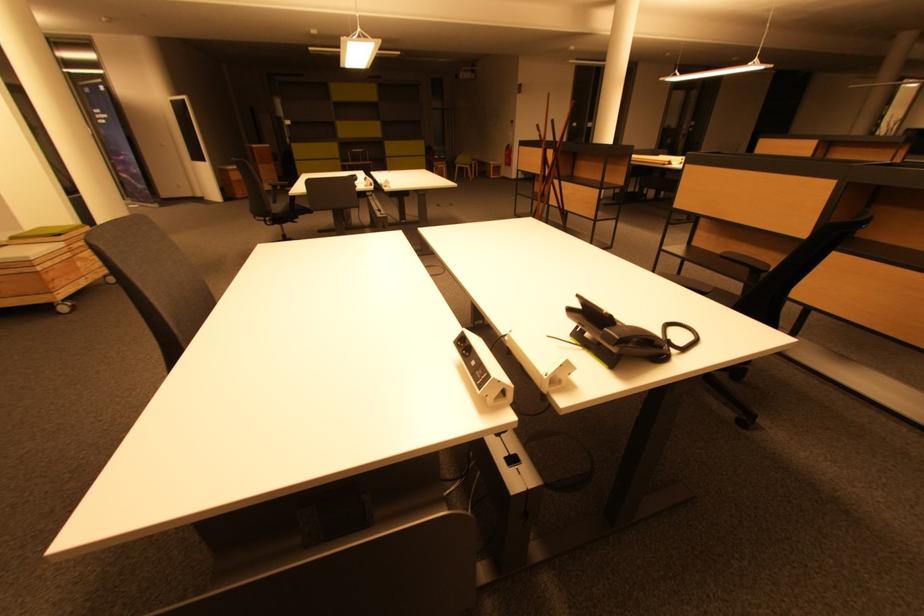
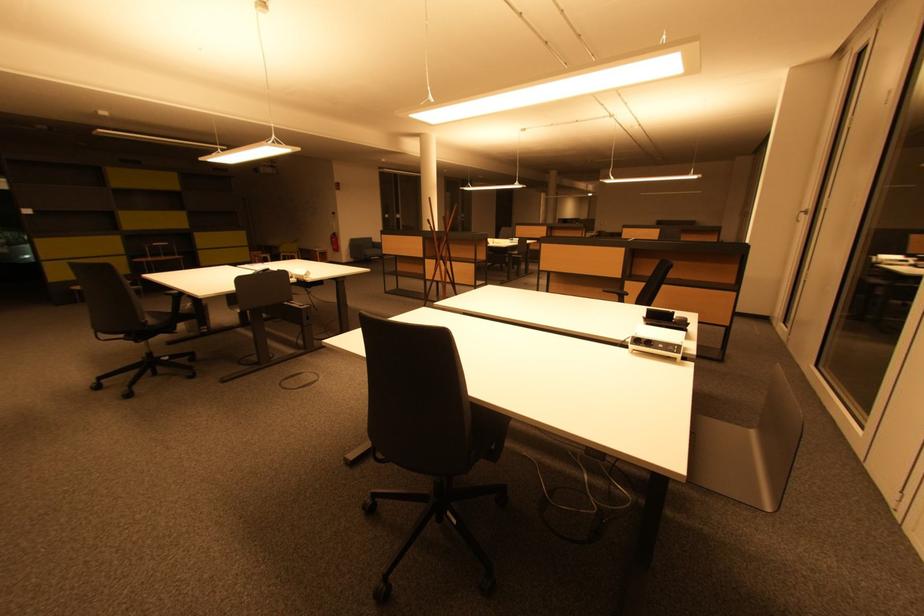
Find the pixel in the second image that matches point (582, 310) in the first image.

(650, 318)